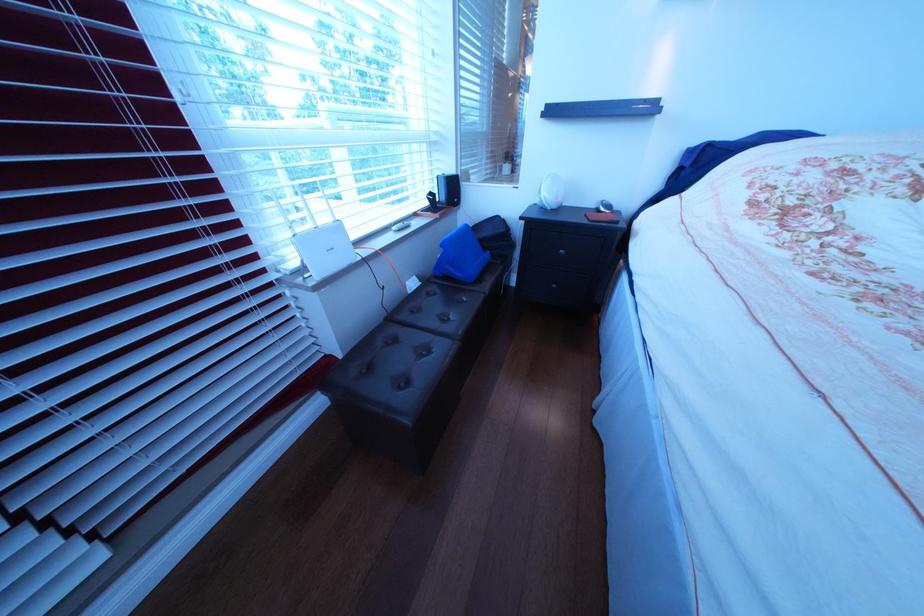
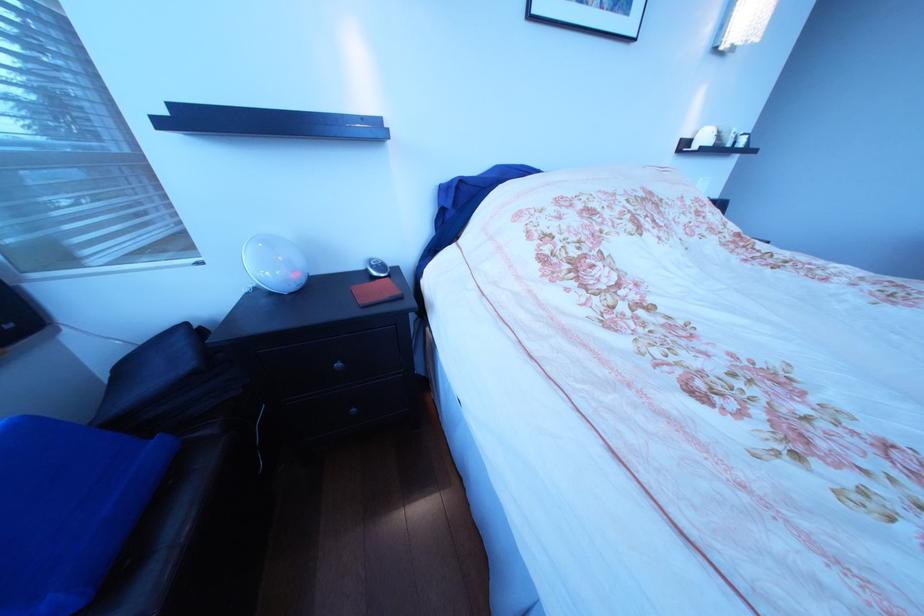
Where in the second image is the point corresponding to point 616,214 from the first image?

(388, 281)